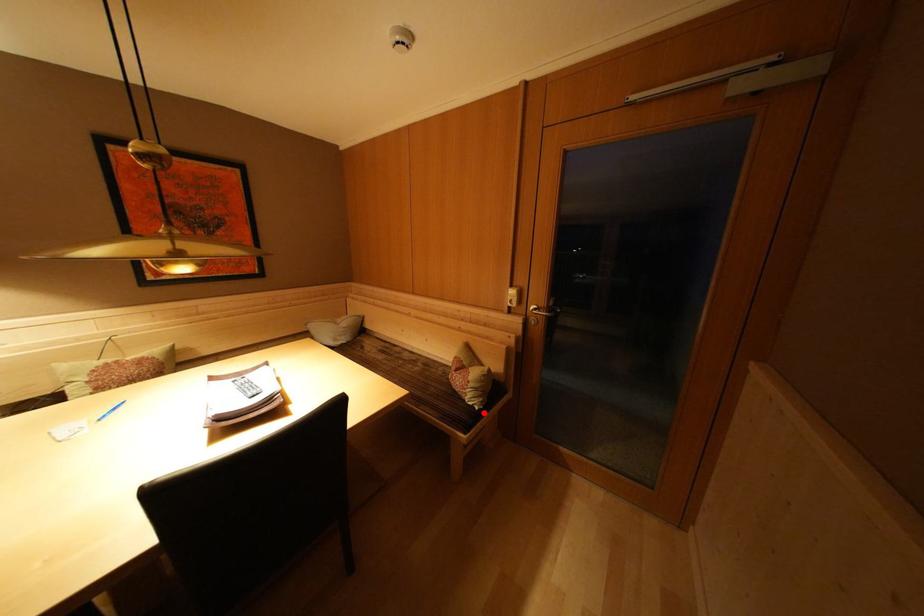
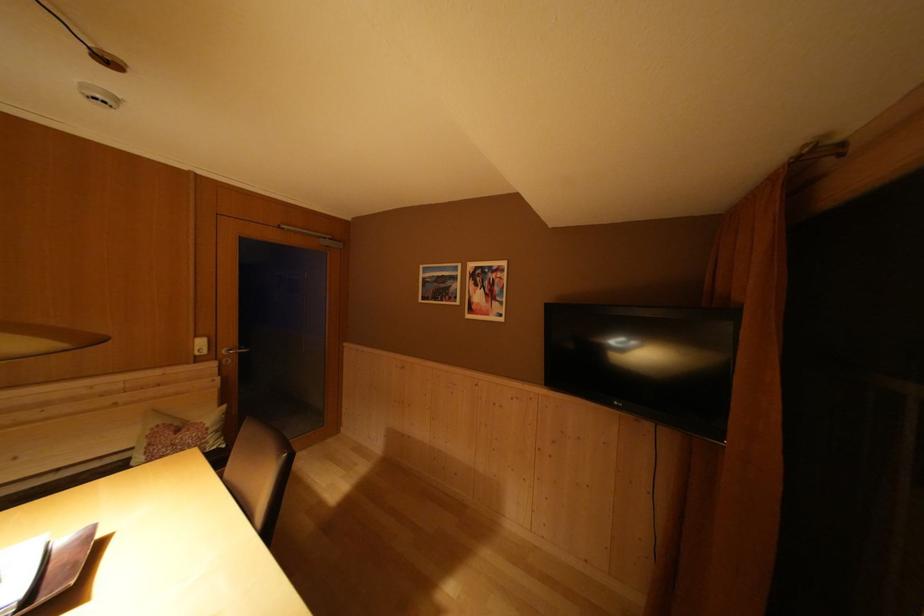
Question: I am providing you with two images of the same scene from different viewpoints. Image1 has a red point marked. In image2, the corresponding 3D location appears at what relative position? Reply with the corresponding letter.

Choices:
 (A) Closer
 (B) Farther

Answer: (B)